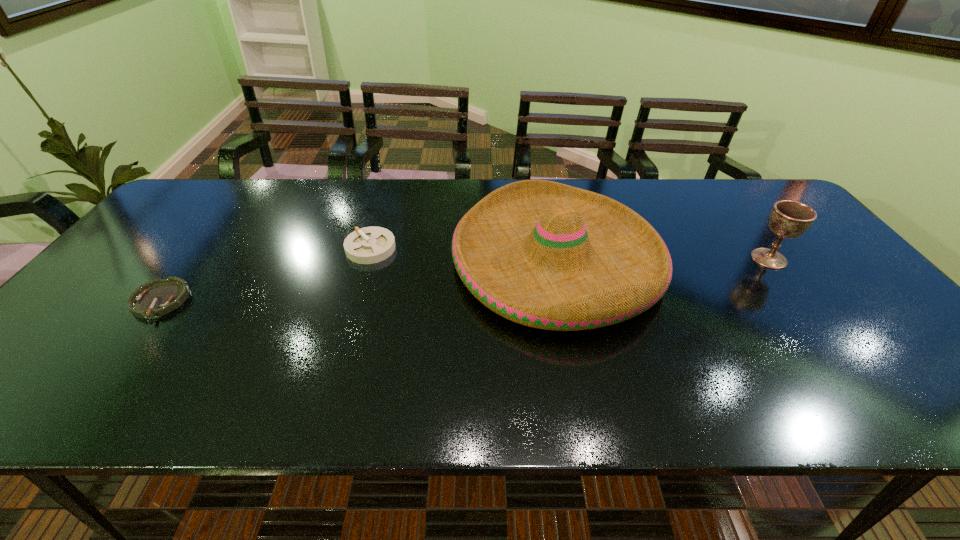
The width and height of the screenshot is (960, 540). I want to click on object that is the closest to the right ashtray, so click(x=543, y=254).

Locate which object is the third closest to the shortest object. Please provide its 2D coordinates. Your answer should be formatted as a tuple, i.e. [(x, y)], where the tuple contains the x and y coordinates of a point satisfying the conditions above.

[(789, 219)]